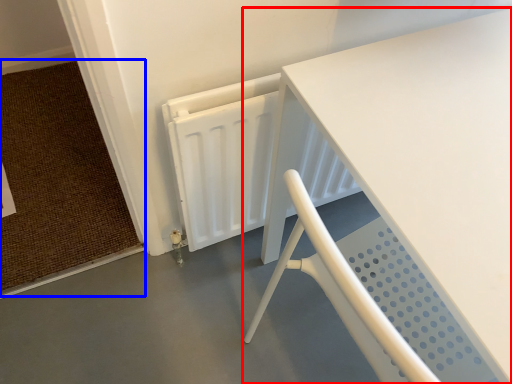
Question: Which object appears farthest to the camera in this image, table (highlighted by a red box) or doormat (highlighted by a blue box)?

Choices:
 (A) table
 (B) doormat

Answer: (B)